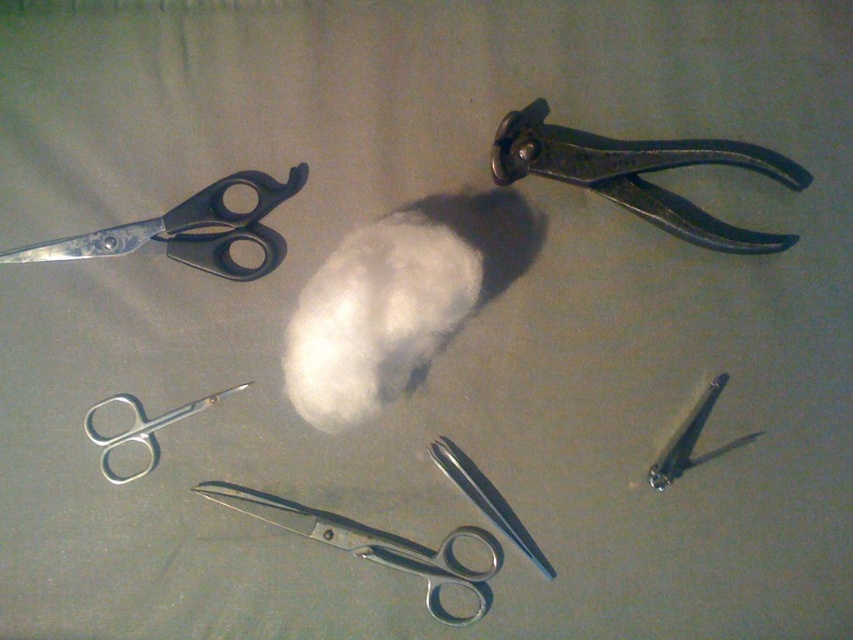
Question: Which point is closer to the camera taking this photo?

Choices:
 (A) (323, 528)
 (B) (361, 266)

Answer: (A)

Question: Does silver metallic scissors at center appear under silver metallic scissors at upper left?

Choices:
 (A) yes
 (B) no

Answer: (A)

Question: Can you confirm if white fluffy cotton at center is bigger than silver metallic scissors at upper left?

Choices:
 (A) yes
 (B) no

Answer: (A)

Question: Observing the image, what is the correct spatial positioning of dark gray metal pliers at upper right in reference to metallic silver nail at center?

Choices:
 (A) above
 (B) below

Answer: (A)

Question: Estimate the real-world distances between objects in this image. Which object is farther from the white fluffy cotton at center?

Choices:
 (A) metallic silver nail at center
 (B) metallic scissors at center
 (C) dark gray metal pliers at upper right
 (D) black plastic scissors at upper left

Answer: (A)

Question: Which of the following is the farthest from the observer?

Choices:
 (A) (283, 500)
 (B) (45, 248)

Answer: (A)